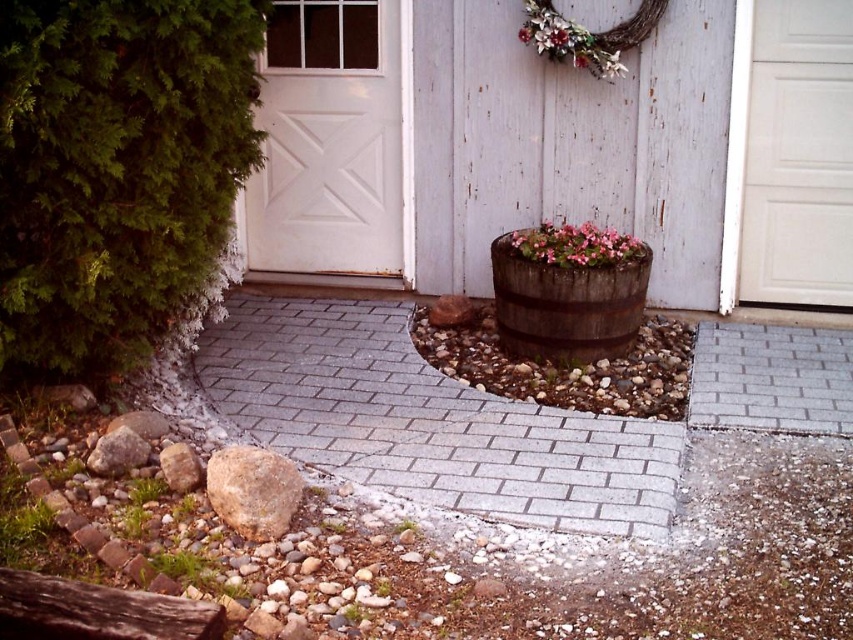
Question: Can you confirm if rustic wooden barrel at center is smaller than wooden wreath at upper center?

Choices:
 (A) yes
 (B) no

Answer: (B)

Question: Is white matte door at right above wooden wreath at upper center?

Choices:
 (A) yes
 (B) no

Answer: (B)

Question: Which point is farther from the camera taking this photo?

Choices:
 (A) (352, 620)
 (B) (166, 253)

Answer: (B)

Question: Is green leafy bush at left below white painted wood door at center?

Choices:
 (A) no
 (B) yes

Answer: (B)

Question: Which of the following is the closest to the observer?

Choices:
 (A) (607, 228)
 (B) (515, 298)

Answer: (B)

Question: Which of these objects is positioned farthest from the wooden wreath at upper center?

Choices:
 (A) green leafy plant at lower center
 (B) white matte door at right

Answer: (A)